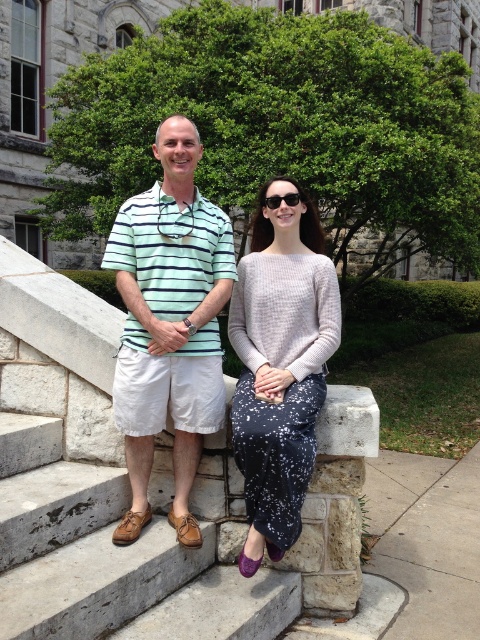
Does brown leather shoe at lower left have a smaller size compared to speckled fabric skirt at center?

Incorrect, brown leather shoe at lower left is not smaller in size than speckled fabric skirt at center.

Between brown leather shoe at lower left and speckled fabric skirt at center, which one appears on the right side from the viewer's perspective?

speckled fabric skirt at center

Where is `brown leather shoe at lower left`? This screenshot has height=640, width=480. brown leather shoe at lower left is located at coordinates 110,557.

Is point (169, 285) closer to viewer compared to point (311, 412)?

No, it is not.

Is striped cotton shirt at center shorter than speckled fabric skirt at center?

Incorrect, striped cotton shirt at center's height does not fall short of speckled fabric skirt at center's.

This screenshot has height=640, width=480. What do you see at coordinates (168, 323) in the screenshot? I see `striped cotton shirt at center` at bounding box center [168, 323].

I want to click on striped cotton shirt at center, so click(168, 323).

Is point (180, 600) more distant than point (291, 195)?

No.

Who is positioned more to the right, brown leather shoe at lower left or black plastic goggles at center?

Positioned to the right is black plastic goggles at center.

The image size is (480, 640). What do you see at coordinates (110, 557) in the screenshot? I see `brown leather shoe at lower left` at bounding box center [110, 557].

Locate an element on the screen. brown leather shoe at lower left is located at coordinates (110, 557).